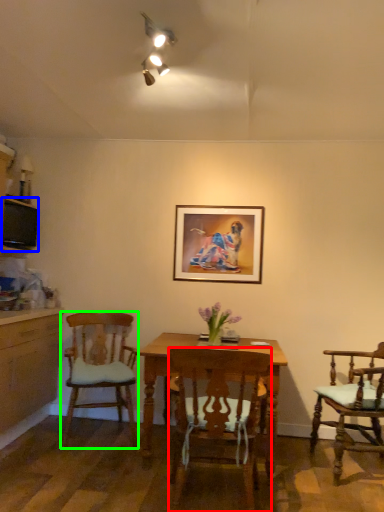
Question: Which is farther away from chair (highlighted by a red box)? television (highlighted by a blue box) or chair (highlighted by a green box)?

Choices:
 (A) television
 (B) chair

Answer: (A)